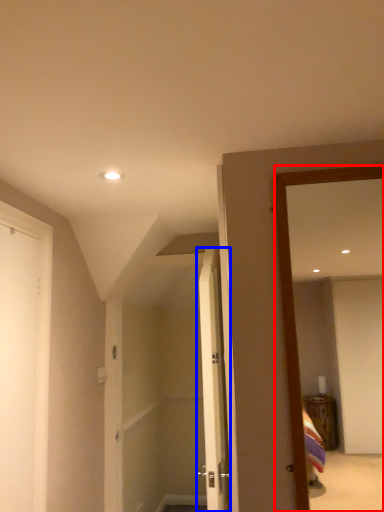
Question: Which object appears closest to the camera in this image, mirror (highlighted by a red box) or door (highlighted by a blue box)?

Choices:
 (A) mirror
 (B) door

Answer: (A)